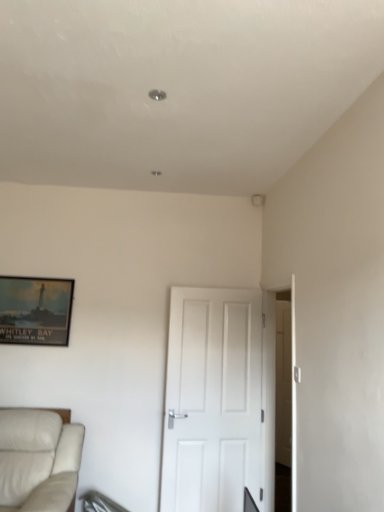
Question: Does white matte door at center have a smaller size compared to white leather studio couch at lower left?

Choices:
 (A) yes
 (B) no

Answer: (A)

Question: Is white matte door at center at the left side of white leather studio couch at lower left?

Choices:
 (A) no
 (B) yes

Answer: (A)

Question: From the image's perspective, would you say white matte door at center is shown under white leather studio couch at lower left?

Choices:
 (A) no
 (B) yes

Answer: (A)

Question: Is white matte door at center turned away from white leather studio couch at lower left?

Choices:
 (A) yes
 (B) no

Answer: (B)

Question: Is white matte door at center shorter than white leather studio couch at lower left?

Choices:
 (A) no
 (B) yes

Answer: (A)

Question: Could white leather studio couch at lower left be considered to be inside white matte door at center?

Choices:
 (A) no
 (B) yes

Answer: (A)

Question: Could white matte door at center be considered to be inside white leather studio couch at lower left?

Choices:
 (A) no
 (B) yes

Answer: (A)

Question: From a real-world perspective, is white leather studio couch at lower left on top of white matte door at center?

Choices:
 (A) yes
 (B) no

Answer: (B)

Question: Does white leather studio couch at lower left appear on the left side of white matte door at center?

Choices:
 (A) no
 (B) yes

Answer: (B)

Question: Does white leather studio couch at lower left have a smaller size compared to white matte door at center?

Choices:
 (A) no
 (B) yes

Answer: (A)

Question: Considering the relative sizes of white leather studio couch at lower left and white matte door at center in the image provided, is white leather studio couch at lower left taller than white matte door at center?

Choices:
 (A) yes
 (B) no

Answer: (B)

Question: Can you confirm if white leather studio couch at lower left is thinner than white matte door at center?

Choices:
 (A) yes
 (B) no

Answer: (B)

Question: Considering the relative sizes of matte black picture frame at upper left and white leather studio couch at lower left in the image provided, is matte black picture frame at upper left bigger than white leather studio couch at lower left?

Choices:
 (A) no
 (B) yes

Answer: (A)